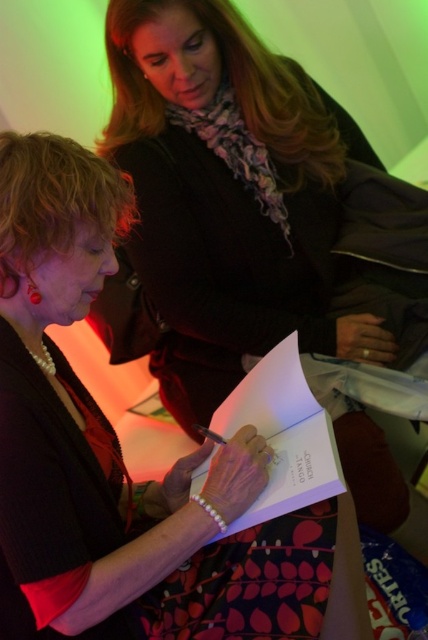
You are attending a book signing event and see two books on the table in front of you. The matte black book at center and the white paper book at center. Which book is positioned to the left?

The matte black book at center is positioned to the left of the white paper book at center.

You are a photographer at a signing event. You need to position a camera to capture the matte black book at center. The camera requires a clear view of the book without obstruction. Based on the scene description, can you confirm if the book is positioned in an area that allows for unobstructed photography?

The matte black book at center is located at point coordinates (x=121, y=460), which is in the center of the scene. Since the scene describes the book as being open on the woman in the foreground lap and visible, it is positioned in an area that allows for unobstructed photography.